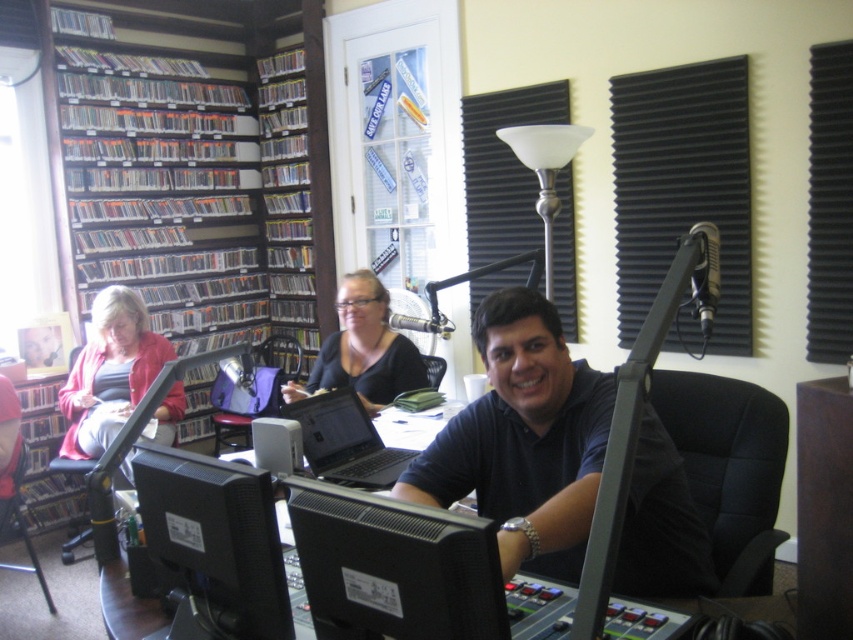
Question: Is black matte shirt at center further to camera compared to matte pink sweater at left?

Choices:
 (A) no
 (B) yes

Answer: (A)

Question: Can you confirm if wooden bookshelf at left is positioned to the left of matte black shirt at center?

Choices:
 (A) no
 (B) yes

Answer: (B)

Question: In this image, where is black matte computer monitor at lower center located relative to black glossy laptop at center?

Choices:
 (A) left
 (B) right

Answer: (A)

Question: Which object is closer to the camera taking this photo?

Choices:
 (A) black glossy monitor at center
 (B) black glossy laptop at center
 (C) wooden bookshelf at left

Answer: (A)

Question: Which point is farther to the camera?

Choices:
 (A) pyautogui.click(x=160, y=513)
 (B) pyautogui.click(x=314, y=460)
 (C) pyautogui.click(x=183, y=45)

Answer: (C)

Question: Based on their relative distances, which object is nearer to the matte black shirt at center?

Choices:
 (A) black matte computer monitor at lower center
 (B) black fabric swivel chair at center
 (C) black glossy laptop at center

Answer: (C)